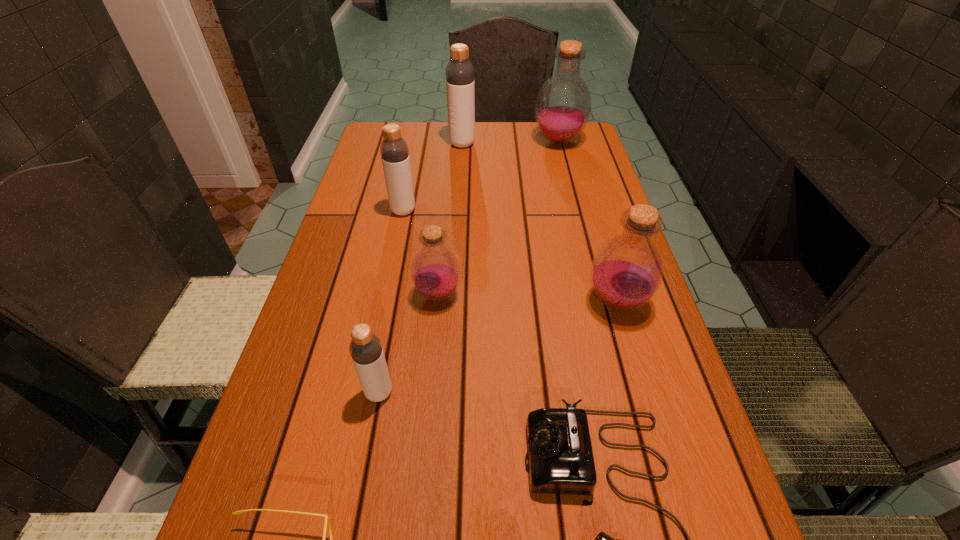
This screenshot has width=960, height=540. I want to click on vacant point located on the front of the farthest purple bottle, so click(574, 203).

Identify the location of vacant area situated 0.340m on the left of the second smallest purple bottle. The image size is (960, 540). (426, 302).

This screenshot has width=960, height=540. Identify the location of free space located 0.140m on the front of the second nearest gray bottle. (395, 254).

Find the location of a particular element. Image resolution: width=960 pixels, height=540 pixels. blank space located 0.330m on the back of the smallest gray bottle is located at coordinates (403, 259).

Locate an element on the screen. The image size is (960, 540). vacant space located on the right of the leftmost purple bottle is located at coordinates (558, 295).

You are a GUI agent. You are given a task and a screenshot of the screen. Output one action in this format:
    pyautogui.click(x=<x>, y=<y>)
    Task: Click on the object at the far right corner
    Image resolution: width=960 pixels, height=540 pixels.
    Given the screenshot: What is the action you would take?
    pyautogui.click(x=563, y=105)

The width and height of the screenshot is (960, 540). In the image, there is a desktop. Identify the location of vacant space at the left edge. (378, 252).

In the image, there is a desktop. In order to click on vacant space at the right edge in this screenshot , I will do `click(673, 466)`.

You are a GUI agent. You are given a task and a screenshot of the screen. Output one action in this format:
    pyautogui.click(x=<x>, y=<y>)
    Task: Click on the vacant region at the far left corner
    The height and width of the screenshot is (540, 960).
    Given the screenshot: What is the action you would take?
    pyautogui.click(x=383, y=139)

The image size is (960, 540). I want to click on vacant point located between the leftmost purple bottle and the rightmost gray bottle, so click(450, 219).